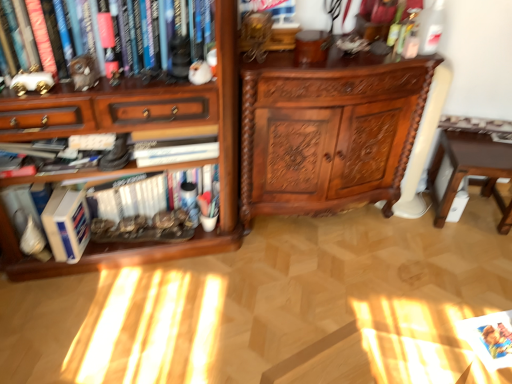
Locate an element on the screen. This screenshot has height=384, width=512. free space in front of wooden bookcase at left is located at coordinates (121, 322).